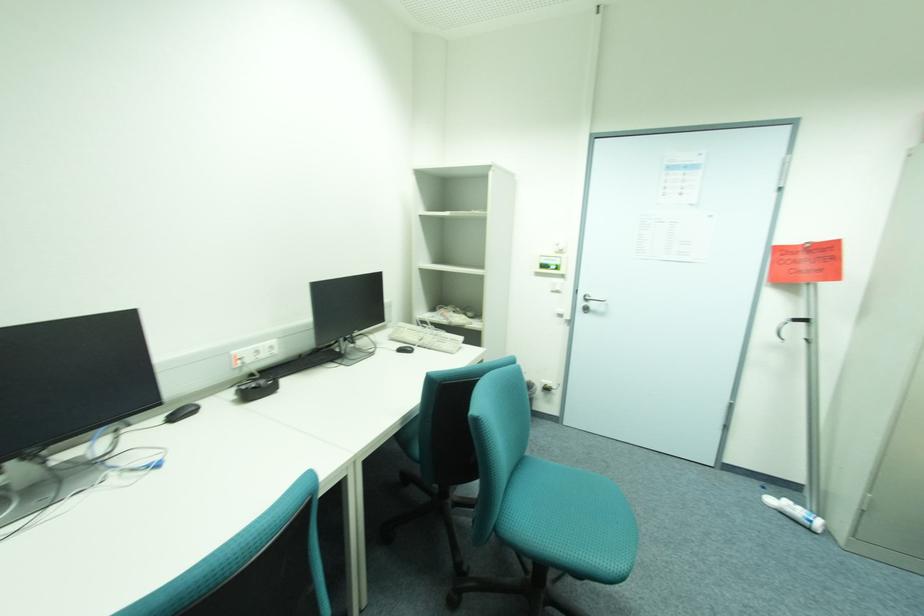
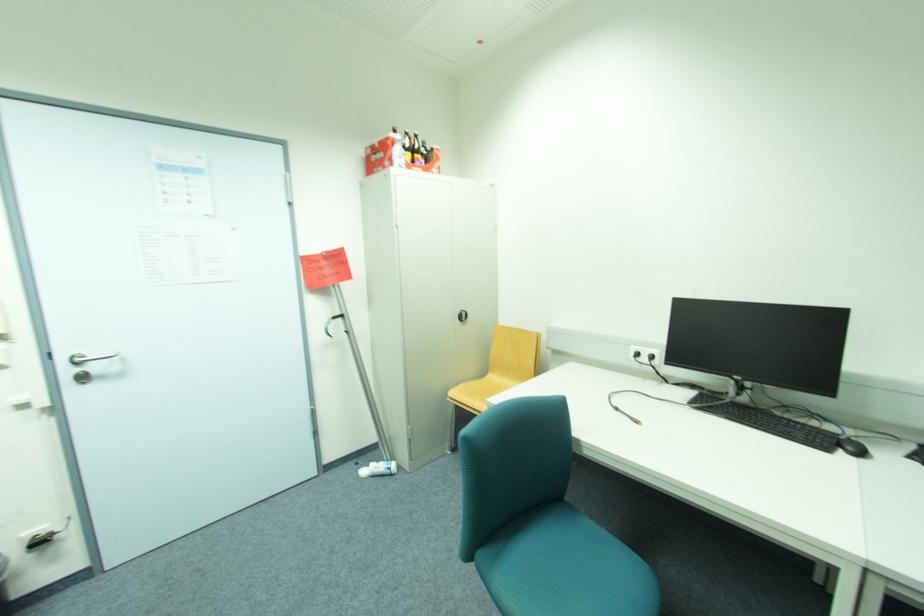
Find the pixel in the second image that matches (x=801, y=320) in the first image.

(339, 317)